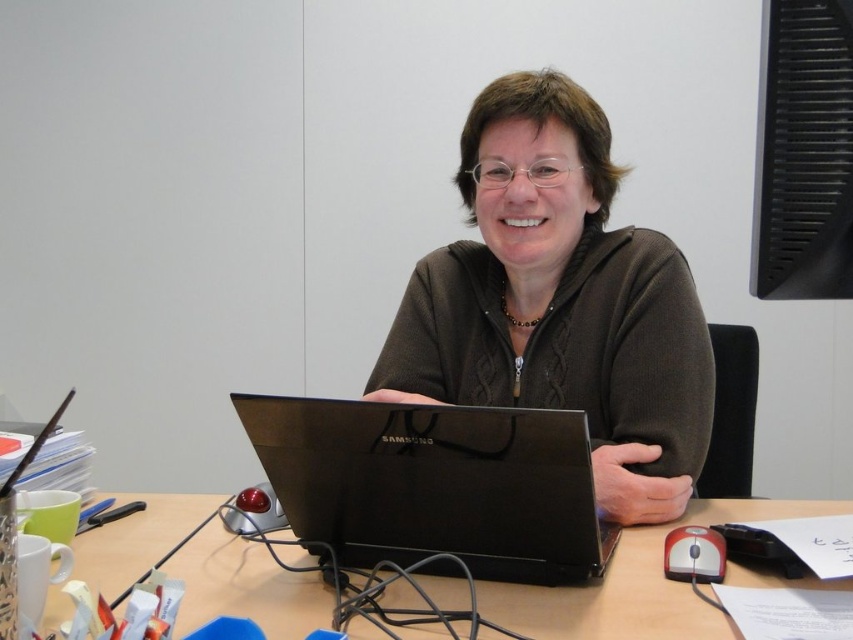
Question: Among these objects, which one is farthest from the camera?

Choices:
 (A) brown sweater at center
 (B) black matte laptop at center

Answer: (A)

Question: Does brown sweater at center have a greater width compared to wooden table at center?

Choices:
 (A) no
 (B) yes

Answer: (A)

Question: Which is nearer to the brown sweater at center?

Choices:
 (A) black matte laptop at center
 (B) wooden table at center

Answer: (A)

Question: Among these objects, which one is nearest to the camera?

Choices:
 (A) wooden table at center
 (B) brown sweater at center
 (C) black matte laptop at center

Answer: (A)

Question: Can you confirm if brown sweater at center is positioned to the right of wooden table at center?

Choices:
 (A) yes
 (B) no

Answer: (A)

Question: Can you confirm if brown sweater at center is positioned below black matte laptop at center?

Choices:
 (A) no
 (B) yes

Answer: (A)